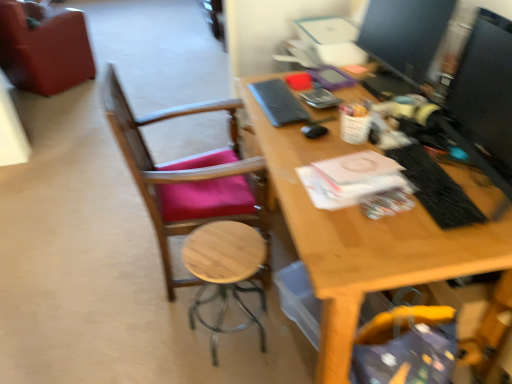
Where is `free space to the left of wooden stool at center`? Image resolution: width=512 pixels, height=384 pixels. free space to the left of wooden stool at center is located at coordinates (153, 332).